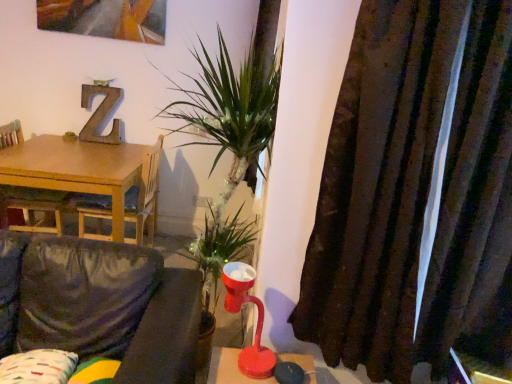
Question: From the image's perspective, does velvet dark grey couch at lower left appear higher than brown textured curtain at right?

Choices:
 (A) no
 (B) yes

Answer: (A)

Question: Can you confirm if velvet dark grey couch at lower left is thinner than brown textured curtain at right?

Choices:
 (A) no
 (B) yes

Answer: (A)

Question: Could you tell me if velvet dark grey couch at lower left is turned towards brown textured curtain at right?

Choices:
 (A) no
 (B) yes

Answer: (A)

Question: Does velvet dark grey couch at lower left appear on the left side of brown textured curtain at right?

Choices:
 (A) yes
 (B) no

Answer: (A)

Question: From the image's perspective, is velvet dark grey couch at lower left under brown textured curtain at right?

Choices:
 (A) no
 (B) yes

Answer: (B)

Question: Do you think velvet dark grey couch at lower left is within matte red table lamp at center, or outside of it?

Choices:
 (A) outside
 (B) inside

Answer: (A)

Question: Is velvet dark grey couch at lower left in front of or behind matte red table lamp at center in the image?

Choices:
 (A) behind
 (B) front

Answer: (B)

Question: From their relative heights in the image, would you say velvet dark grey couch at lower left is taller or shorter than matte red table lamp at center?

Choices:
 (A) short
 (B) tall

Answer: (B)

Question: From the image's perspective, is velvet dark grey couch at lower left above or below matte red table lamp at center?

Choices:
 (A) above
 (B) below

Answer: (B)

Question: Is matte red table lamp at center inside or outside of patterned fabric pillow at lower left?

Choices:
 (A) inside
 (B) outside

Answer: (B)

Question: Is point (230, 281) positioned closer to the camera than point (72, 365)?

Choices:
 (A) closer
 (B) farther

Answer: (A)

Question: In terms of size, does matte red table lamp at center appear bigger or smaller than patterned fabric pillow at lower left?

Choices:
 (A) small
 (B) big

Answer: (A)

Question: From a real-world perspective, is matte red table lamp at center positioned above or below patterned fabric pillow at lower left?

Choices:
 (A) above
 (B) below

Answer: (A)

Question: From a real-world perspective, is wooden table at left positioned above or below matte red table lamp at center?

Choices:
 (A) below
 (B) above

Answer: (A)

Question: In terms of width, does wooden table at left look wider or thinner when compared to matte red table lamp at center?

Choices:
 (A) wide
 (B) thin

Answer: (A)